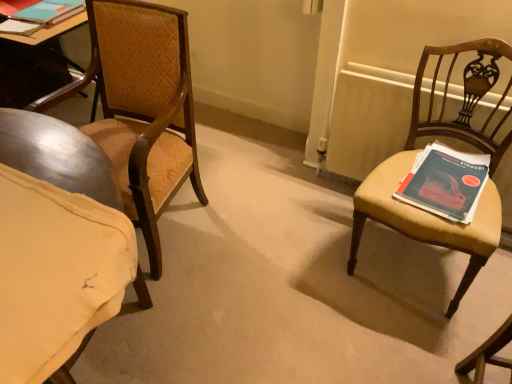
Question: Could wooden radiator at right be considered to be inside matte blue book at right, which is the 2th book from back to front?

Choices:
 (A) yes
 (B) no

Answer: (B)

Question: Is wooden radiator at right at the back of matte blue book at right, which appears as the first book when viewed from the front?

Choices:
 (A) no
 (B) yes

Answer: (B)

Question: From a real-world perspective, is matte blue book at right, which appears as the second book when viewed from the left, on wooden radiator at right?

Choices:
 (A) yes
 (B) no

Answer: (A)

Question: From the image's perspective, does matte blue book at right, which appears as the second book when viewed from the left, appear lower than wooden radiator at right?

Choices:
 (A) yes
 (B) no

Answer: (A)

Question: Is matte blue book at right, which is the first book in bottom-to-top order, next to wooden radiator at right and touching it?

Choices:
 (A) yes
 (B) no

Answer: (B)

Question: From a real-world perspective, is matte blue book at right, which appears as the second book when viewed from the left, physically located above or below wooden radiator at right?

Choices:
 (A) below
 (B) above

Answer: (B)

Question: Relative to wooden radiator at right, is matte blue book at right, which is the 2th book from back to front, in front or behind?

Choices:
 (A) behind
 (B) front

Answer: (B)

Question: Would you say matte blue book at right, the second book from the top, is inside or outside wooden radiator at right?

Choices:
 (A) inside
 (B) outside

Answer: (B)

Question: From the image's perspective, is matte blue book at right, which appears as the first book when viewed from the front, located above or below wooden radiator at right?

Choices:
 (A) above
 (B) below

Answer: (B)

Question: From a real-world perspective, is matte brown chair at right, which is the first chair in right-to-left order, physically located above or below wooden radiator at right?

Choices:
 (A) above
 (B) below

Answer: (A)

Question: Considering the positions of matte brown chair at right, arranged as the 2th chair when viewed from the left, and wooden radiator at right in the image, is matte brown chair at right, arranged as the 2th chair when viewed from the left, bigger or smaller than wooden radiator at right?

Choices:
 (A) small
 (B) big

Answer: (B)

Question: Considering the positions of matte brown chair at right, which is the first chair in right-to-left order, and wooden radiator at right in the image, is matte brown chair at right, which is the first chair in right-to-left order, taller or shorter than wooden radiator at right?

Choices:
 (A) tall
 (B) short

Answer: (A)

Question: Do you think matte brown chair at right, arranged as the 2th chair when viewed from the left, is within wooden radiator at right, or outside of it?

Choices:
 (A) outside
 (B) inside

Answer: (A)

Question: Does point (178, 97) appear closer or farther from the camera than point (392, 145)?

Choices:
 (A) farther
 (B) closer

Answer: (B)

Question: Looking at their shapes, would you say wooden textured chair at left, which ranks as the second chair in right-to-left order, is wider or thinner than wooden radiator at right?

Choices:
 (A) wide
 (B) thin

Answer: (A)